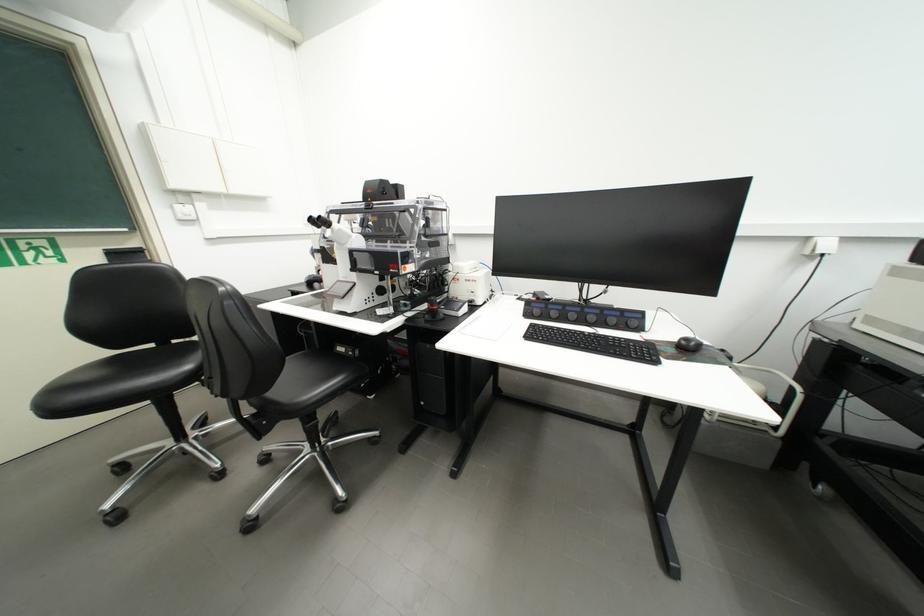
Image resolution: width=924 pixels, height=616 pixels. I want to click on black joystick controller, so click(x=688, y=344).